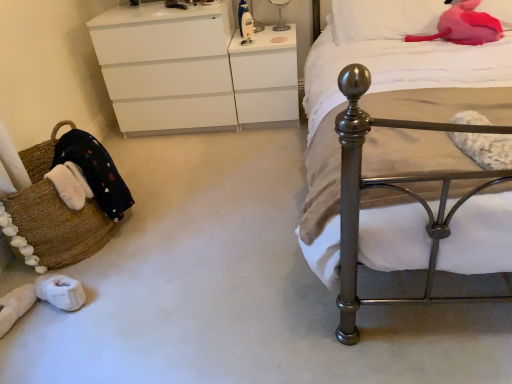
Question: In the image, is polished metal bed at right positioned in front of or behind transparent glass lamp at upper center?

Choices:
 (A) behind
 (B) front

Answer: (B)

Question: From a real-world perspective, is polished metal bed at right physically located above or below transparent glass lamp at upper center?

Choices:
 (A) below
 (B) above

Answer: (A)

Question: Which is nearer to the pink plush at upper right, positioned as the 1th pillow in left-to-right order?

Choices:
 (A) polished metal bed at right
 (B) brown woven basket at lower left
 (C) white matte chest of drawers at upper left
 (D) transparent glass lamp at upper center
 (E) white glossy changing table at upper center

Answer: (A)

Question: Which object is positioned farthest from the pink plush at upper right, positioned as the 1th pillow in left-to-right order?

Choices:
 (A) white matte chest of drawers at upper left
 (B) polished metal bed at right
 (C) pink plush pillow at upper right, which is the first pillow from right to left
 (D) transparent glass lamp at upper center
 (E) white glossy changing table at upper center

Answer: (A)